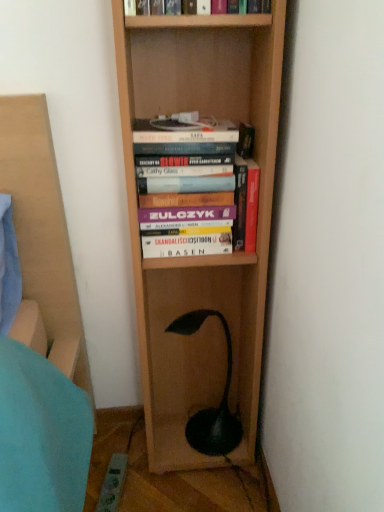
Where is `hardcover book at upper center, placed as the 1th book when sorted from top to bottom`? Image resolution: width=384 pixels, height=512 pixels. hardcover book at upper center, placed as the 1th book when sorted from top to bottom is located at coordinates (260, 6).

Locate an element on the screen. This screenshot has height=512, width=384. hardcover book at center, acting as the 3th book starting from the top is located at coordinates (251, 205).

Who is bigger, hardcover book at upper center, placed as the 1th book when sorted from top to bottom, or green matte lamp at lower center?

green matte lamp at lower center.

Identify the location of lamp on the right side of hardcover book at upper center, placed as the 1th book when sorted from top to bottom. The width and height of the screenshot is (384, 512). (210, 408).

What's the angular difference between hardcover book at upper center, the 3th book from the bottom, and green matte lamp at lower center's facing directions?

The facing directions of hardcover book at upper center, the 3th book from the bottom, and green matte lamp at lower center are 3.57 degrees apart.

In the scene shown: From the image's perspective, does hardcover books at center, placed as the 2th book when sorted from bottom to top, appear lower than green matte lamp at lower center?

No.

Based on the photo, is green matte lamp at lower center at the back of hardcover books at center, placed as the 2th book when sorted from bottom to top?

No, hardcover books at center, placed as the 2th book when sorted from bottom to top, is not facing away from green matte lamp at lower center.

Considering the sizes of objects hardcover books at center, the 2th book viewed from the top, and green matte lamp at lower center in the image provided, who is taller, hardcover books at center, the 2th book viewed from the top, or green matte lamp at lower center?

green matte lamp at lower center is taller.

Which object is positioned more to the left, hardcover books at center, placed as the 2th book when sorted from bottom to top, or green matte lamp at lower center?

Positioned to the left is hardcover books at center, placed as the 2th book when sorted from bottom to top.

Which of these two, green matte lamp at lower center or hardcover book at upper center, placed as the 1th book when sorted from top to bottom, is bigger?

green matte lamp at lower center is bigger.

Which is correct: green matte lamp at lower center is inside hardcover book at upper center, the 3th book from the bottom, or outside of it?

green matte lamp at lower center is not enclosed by hardcover book at upper center, the 3th book from the bottom.

From a real-world perspective, which is physically below, green matte lamp at lower center or hardcover book at upper center, placed as the 1th book when sorted from top to bottom?

From a 3D spatial view, green matte lamp at lower center is below.

Which of these two, green matte lamp at lower center or hardcover book at upper center, placed as the 1th book when sorted from top to bottom, is wider?

green matte lamp at lower center.

Who is more distant, hardcover book at center, the first book from the bottom, or green matte lamp at lower center?

green matte lamp at lower center.

Does point (249, 213) lie in front of point (227, 344)?

Yes, it is in front of point (227, 344).

Is hardcover book at center, the first book from the bottom, not within green matte lamp at lower center?

Yes, hardcover book at center, the first book from the bottom, is located beyond the bounds of green matte lamp at lower center.

From a real-world perspective, is hardcover book at center, acting as the 3th book starting from the top, above or below green matte lamp at lower center?

hardcover book at center, acting as the 3th book starting from the top, is above green matte lamp at lower center.

Does point (209, 447) lie in front of point (196, 130)?

No, (209, 447) is behind (196, 130).

Is green matte lamp at lower center positioned with its back to hardcover books at center, placed as the 2th book when sorted from bottom to top?

That's not correct — green matte lamp at lower center is not looking away from hardcover books at center, placed as the 2th book when sorted from bottom to top.

Does green matte lamp at lower center appear on the right side of hardcover books at center, the 2th book viewed from the top?

Correct, you'll find green matte lamp at lower center to the right of hardcover books at center, the 2th book viewed from the top.

From the image's perspective, between green matte lamp at lower center and hardcover books at center, placed as the 2th book when sorted from bottom to top, who is located below?

green matte lamp at lower center is shown below in the image.

Considering the positions of point (184, 4) and point (253, 247), is point (184, 4) closer or farther from the camera than point (253, 247)?

Point (184, 4) appears to be closer to the viewer than point (253, 247).

Which of these two, hardcover book at upper center, placed as the 1th book when sorted from top to bottom, or hardcover book at center, the first book from the bottom, is smaller?

hardcover book at center, the first book from the bottom, is smaller.

Does hardcover book at upper center, placed as the 1th book when sorted from top to bottom, touch hardcover book at center, the first book from the bottom?

hardcover book at upper center, placed as the 1th book when sorted from top to bottom, and hardcover book at center, the first book from the bottom, are not in contact.

From a real-world perspective, is hardcover book at upper center, placed as the 1th book when sorted from top to bottom, located higher than hardcover book at center, acting as the 3th book starting from the top?

Yes, from a real-world perspective, hardcover book at upper center, placed as the 1th book when sorted from top to bottom, is on top of hardcover book at center, acting as the 3th book starting from the top.

Who is smaller, hardcover book at center, acting as the 3th book starting from the top, or hardcover book at upper center, placed as the 1th book when sorted from top to bottom?

hardcover book at center, acting as the 3th book starting from the top, is smaller.

Is point (258, 184) closer to camera compared to point (251, 4)?

No, it is not.

From the image's perspective, is hardcover book at center, the first book from the bottom, on hardcover book at upper center, the 3th book from the bottom?

No.

Is hardcover book at center, acting as the 3th book starting from the top, in contact with hardcover book at upper center, placed as the 1th book when sorted from top to bottom?

hardcover book at center, acting as the 3th book starting from the top, is not next to hardcover book at upper center, placed as the 1th book when sorted from top to bottom, and they're not touching.

At what (x,y) coordinates should I click in order to perform the action: click on the 3rd book in front of the green matte lamp at lower center. Please return your answer as a coordinate pair (x, y). The width and height of the screenshot is (384, 512). Looking at the image, I should click on coord(260,6).

This screenshot has width=384, height=512. I want to click on lamp located on the right of hardcover books at center, the 2th book viewed from the top, so click(x=210, y=408).

From the image, which object appears to be nearer to hardcover books at center, placed as the 2th book when sorted from bottom to top, hardcover book at upper center, placed as the 1th book when sorted from top to bottom, or green matte lamp at lower center?

hardcover book at upper center, placed as the 1th book when sorted from top to bottom, is positioned closer to the anchor hardcover books at center, placed as the 2th book when sorted from bottom to top.

Based on their spatial positions, is hardcover books at center, the 2th book viewed from the top, or hardcover book at upper center, placed as the 1th book when sorted from top to bottom, closer to hardcover book at center, the first book from the bottom?

The object closer to hardcover book at center, the first book from the bottom, is hardcover books at center, the 2th book viewed from the top.

Which object lies further to the anchor point hardcover book at upper center, placed as the 1th book when sorted from top to bottom, green matte lamp at lower center or hardcover book at center, the first book from the bottom?

green matte lamp at lower center is further to hardcover book at upper center, placed as the 1th book when sorted from top to bottom.

Which object lies nearer to the anchor point hardcover book at center, acting as the 3th book starting from the top, hardcover book at upper center, the 3th book from the bottom, or green matte lamp at lower center?

The object closer to hardcover book at center, acting as the 3th book starting from the top, is hardcover book at upper center, the 3th book from the bottom.

Looking at the image, which one is located closer to green matte lamp at lower center, hardcover book at upper center, placed as the 1th book when sorted from top to bottom, or hardcover books at center, placed as the 2th book when sorted from bottom to top?

hardcover books at center, placed as the 2th book when sorted from bottom to top, lies closer to green matte lamp at lower center than the other object.

Looking at the image, which one is located closer to hardcover book at center, acting as the 3th book starting from the top, hardcover books at center, placed as the 2th book when sorted from bottom to top, or green matte lamp at lower center?

hardcover books at center, placed as the 2th book when sorted from bottom to top, is closer to hardcover book at center, acting as the 3th book starting from the top.

Estimate the real-world distances between objects in this image. Which object is further from hardcover books at center, placed as the 2th book when sorted from bottom to top, hardcover book at upper center, the 3th book from the bottom, or hardcover book at center, acting as the 3th book starting from the top?

hardcover book at upper center, the 3th book from the bottom.

When comparing their distances from hardcover book at upper center, the 3th book from the bottom, does hardcover books at center, the 2th book viewed from the top, or hardcover book at center, the first book from the bottom, seem closer?

The object closer to hardcover book at upper center, the 3th book from the bottom, is hardcover books at center, the 2th book viewed from the top.

Identify the location of book between hardcover books at center, the 2th book viewed from the top, and green matte lamp at lower center vertically. This screenshot has width=384, height=512. (251, 205).

This screenshot has height=512, width=384. In order to click on book between hardcover book at upper center, the 3th book from the bottom, and hardcover book at center, the first book from the bottom, in the up-down direction in this screenshot , I will do `click(194, 188)`.